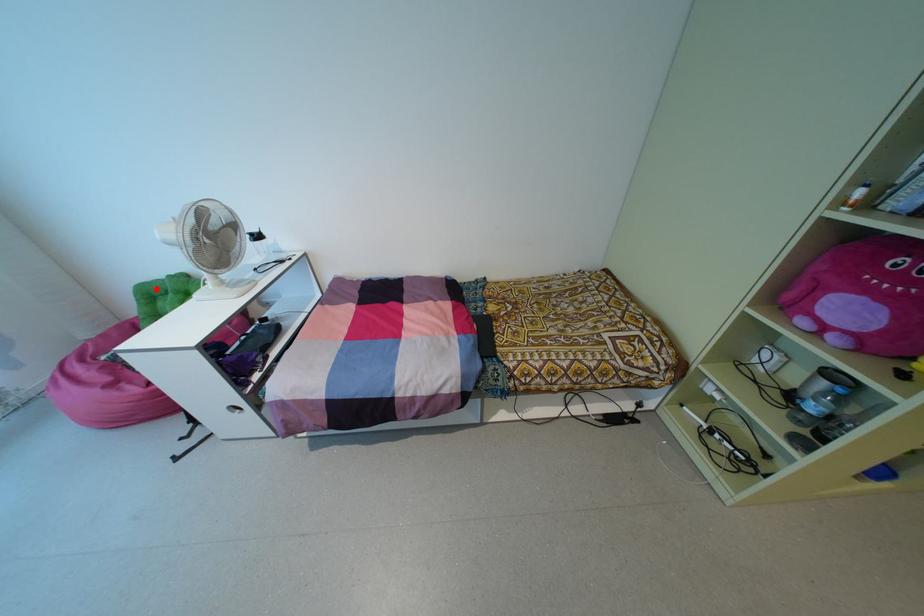
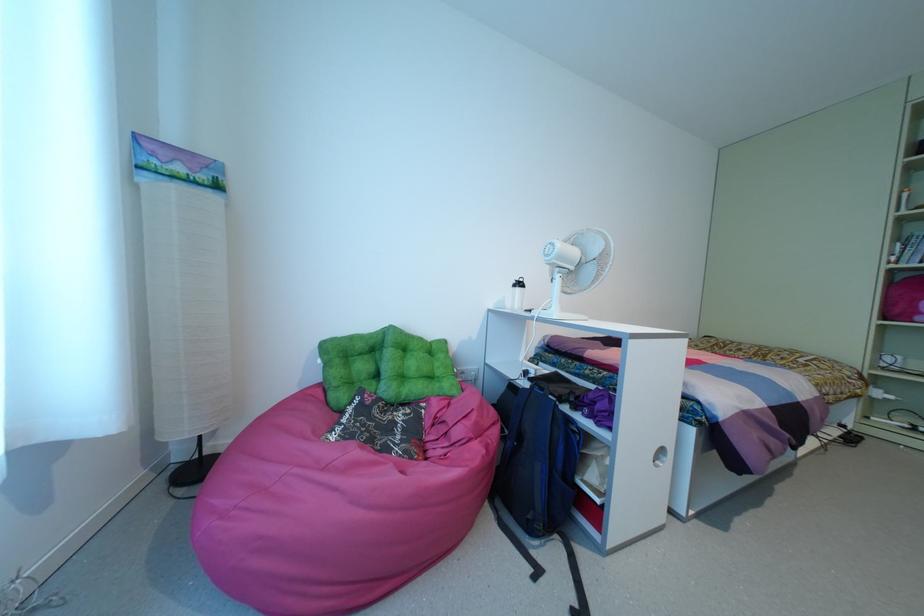
Find the pixel in the second image that matches the highlighted location in the first image.

(359, 345)